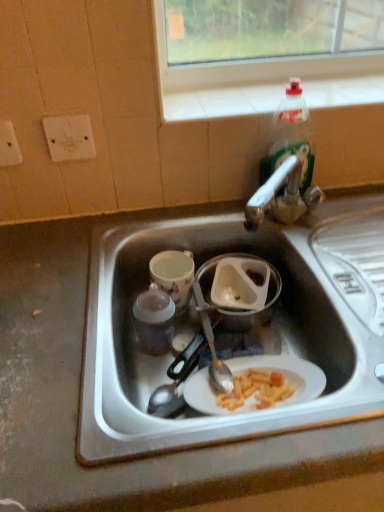
Question: Is white plastic container at center a part of porcelain cup at center-left?

Choices:
 (A) no
 (B) yes

Answer: (A)

Question: Does porcelain cup at center-left have a greater width compared to white plastic container at center?

Choices:
 (A) no
 (B) yes

Answer: (A)

Question: Considering the relative sizes of porcelain cup at center-left and white plastic container at center in the image provided, is porcelain cup at center-left bigger than white plastic container at center?

Choices:
 (A) no
 (B) yes

Answer: (B)

Question: Is porcelain cup at center-left beside white plastic container at center?

Choices:
 (A) no
 (B) yes

Answer: (B)

Question: Is porcelain cup at center-left positioned beyond the bounds of white plastic container at center?

Choices:
 (A) yes
 (B) no

Answer: (A)

Question: Is porcelain cup at center-left turned away from white plastic container at center?

Choices:
 (A) no
 (B) yes

Answer: (A)

Question: Does clear plastic bottle at upper right have a greater width compared to white matte sink at center?

Choices:
 (A) yes
 (B) no

Answer: (B)

Question: Does clear plastic bottle at upper right have a greater height compared to white matte sink at center?

Choices:
 (A) yes
 (B) no

Answer: (A)

Question: Is white matte sink at center a part of clear plastic bottle at upper right?

Choices:
 (A) no
 (B) yes

Answer: (A)

Question: From the image's perspective, is clear plastic bottle at upper right on white matte sink at center?

Choices:
 (A) yes
 (B) no

Answer: (A)

Question: Does clear plastic bottle at upper right have a lesser width compared to white matte sink at center?

Choices:
 (A) no
 (B) yes

Answer: (B)

Question: From the image's perspective, is clear plastic bottle at upper right below white matte sink at center?

Choices:
 (A) no
 (B) yes

Answer: (A)

Question: Is white plastic container at center in front of white matte sink at center?

Choices:
 (A) yes
 (B) no

Answer: (B)